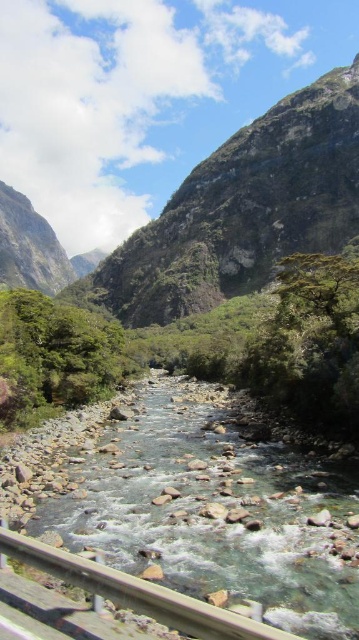
Consider the image. Is smooth rock stream at center further to camera compared to wooden rail at lower left?

That is True.

I want to click on smooth rock stream at center, so click(x=213, y=509).

Does green rocky mountain at upper center appear on the left side of wooden rail at lower left?

Incorrect, green rocky mountain at upper center is not on the left side of wooden rail at lower left.

Measure the distance between green rocky mountain at upper center and camera.

A distance of 164.66 meters exists between green rocky mountain at upper center and camera.

You are a GUI agent. You are given a task and a screenshot of the screen. Output one action in this format:
    pyautogui.click(x=<x>, y=<y>)
    Task: Click on the green rocky mountain at upper center
    
    Given the screenshot: What is the action you would take?
    pyautogui.click(x=243, y=211)

Does smooth rock stream at center appear over green rocky mountain at upper center?

Incorrect, smooth rock stream at center is not positioned above green rocky mountain at upper center.

Measure the distance between smooth rock stream at center and green rocky mountain at upper center.

smooth rock stream at center and green rocky mountain at upper center are 182.33 meters apart.

Measure the distance between point (146,524) and camera.

A distance of 74.64 feet exists between point (146,524) and camera.

Find the location of a particular element. Image resolution: width=359 pixels, height=640 pixels. smooth rock stream at center is located at coordinates (213, 509).